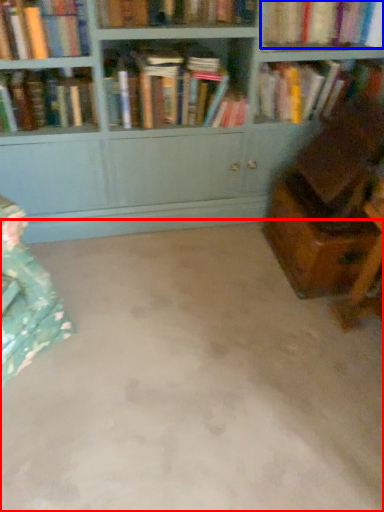
Question: Which of the following is the closest to the observer, concrete (highlighted by a red box) or book (highlighted by a blue box)?

Choices:
 (A) concrete
 (B) book

Answer: (A)